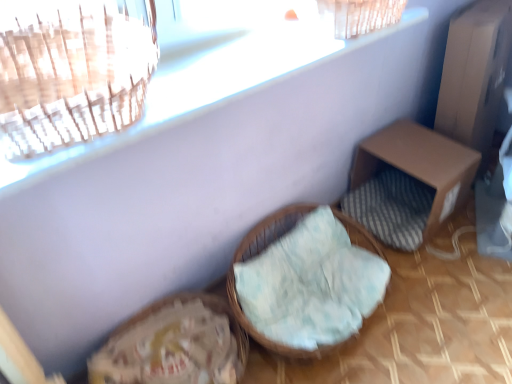
Locate an element on the screen. The width and height of the screenshot is (512, 384). free space in front of brown cardboard box at right, the 1th furniture from the right is located at coordinates (449, 287).